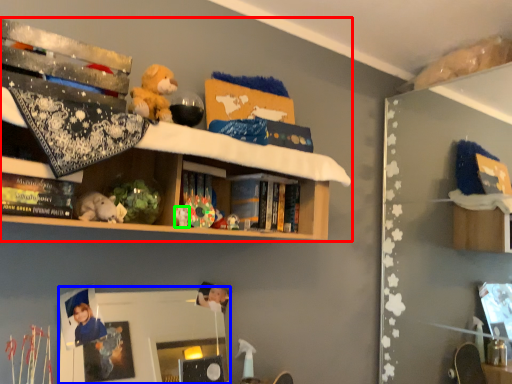
Question: Considering the real-world distances, which object is farthest from shelf (highlighted by a red box)? mirror (highlighted by a blue box) or toy (highlighted by a green box)?

Choices:
 (A) mirror
 (B) toy

Answer: (A)